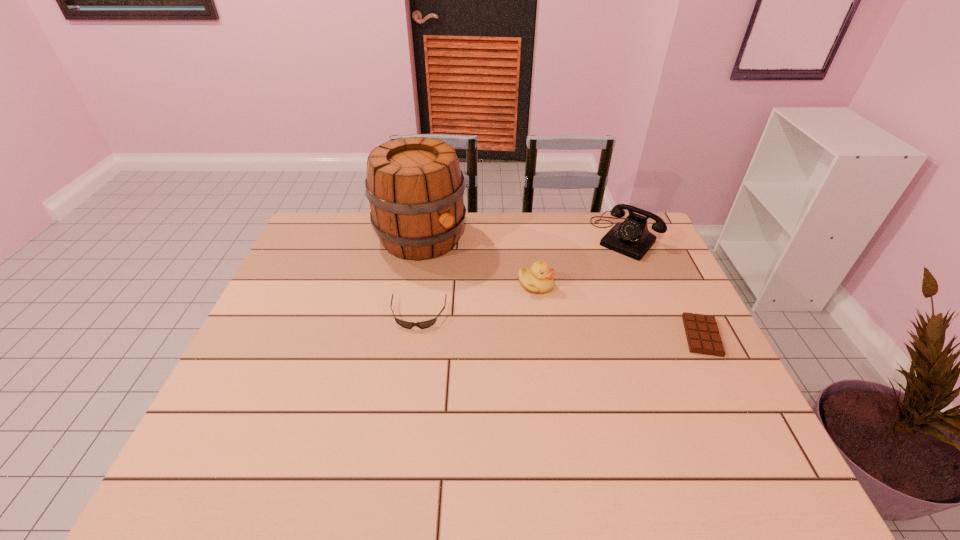
You are a GUI agent. You are given a task and a screenshot of the screen. Output one action in this format:
    pyautogui.click(x=<x>, y=<y>)
    Task: Click on the second shortest object
    The height and width of the screenshot is (540, 960).
    Given the screenshot: What is the action you would take?
    pyautogui.click(x=424, y=324)

Where is `the shortest object`? the shortest object is located at coordinates 702,333.

The height and width of the screenshot is (540, 960). Find the location of `the second tallest object`. the second tallest object is located at coordinates (631, 237).

Where is `the tallest object`? Image resolution: width=960 pixels, height=540 pixels. the tallest object is located at coordinates (415, 187).

The image size is (960, 540). I want to click on the third tallest object, so tap(539, 278).

Identify the location of the third nearest object. (539, 278).

Locate an element on the screen. vacant area located on the front-facing side of the fourth tallest object is located at coordinates (401, 430).

Where is `vacant point located 0.310m on the back of the candy bar`? The height and width of the screenshot is (540, 960). vacant point located 0.310m on the back of the candy bar is located at coordinates (659, 249).

This screenshot has width=960, height=540. I want to click on vacant space located on the front face of the telephone, so click(x=555, y=322).

The image size is (960, 540). Identify the location of vacant space located on the front face of the telephone. (581, 293).